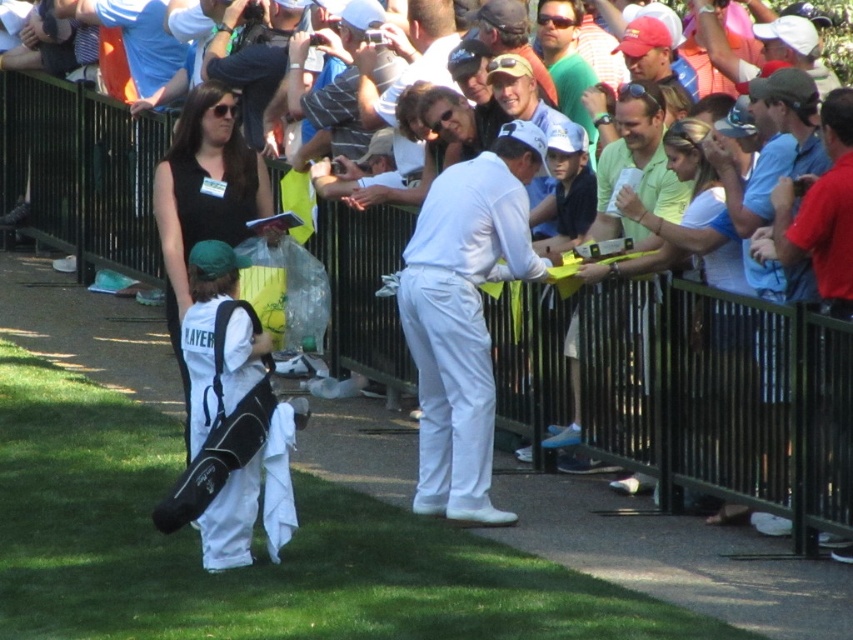
Based on the scene description, can you determine the spatial relationship between the white matte golf pants at center and the red shirt at center?

The white matte golf pants at center are to the left of the red shirt at center.

You are a photographer at the golf tournament. You need to capture a photo of the light green shirt at center and the red shirt at center. Which one should you zoom in on to ensure it fills the frame better?

The light green shirt at center is bigger than the red shirt at center, so you should zoom in on the light green shirt at center to ensure it fills the frame better.